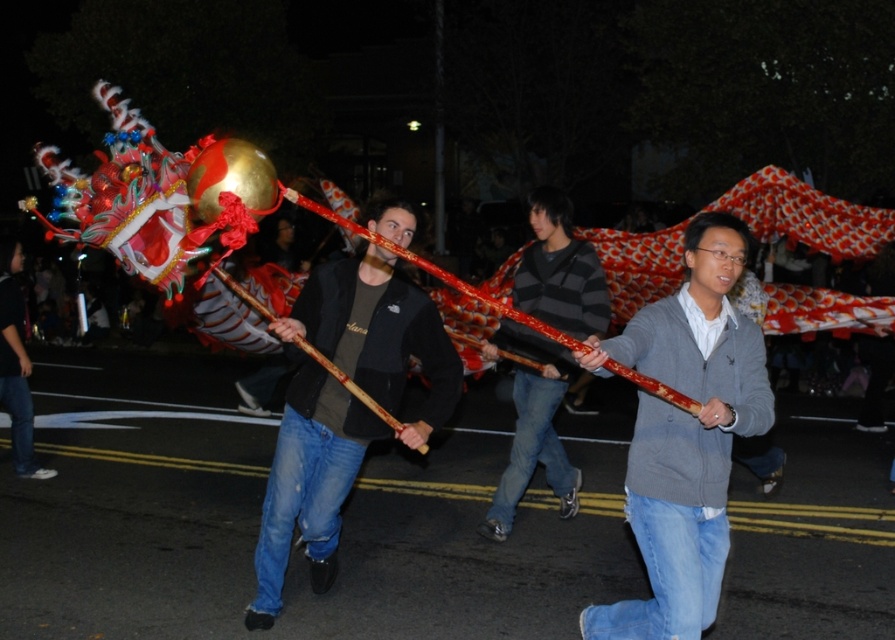
Measure the distance between gray sweater at center and camera.

gray sweater at center is 3.21 meters from camera.

Who is shorter, gray sweater at center or striped sweater at center?

With less height is gray sweater at center.

Is point (720, 314) positioned before point (570, 468)?

Yes, point (720, 314) is in front of point (570, 468).

Image resolution: width=895 pixels, height=640 pixels. In order to click on gray sweater at center in this screenshot , I will do `click(685, 435)`.

Between gray sweater at center and matte black jacket at center, which one has less height?

With less height is gray sweater at center.

Does gray sweater at center appear under matte black jacket at center?

Indeed, gray sweater at center is positioned under matte black jacket at center.

Identify the location of gray sweater at center. The width and height of the screenshot is (895, 640). (685, 435).

Locate an element on the screen. gray sweater at center is located at coordinates (685, 435).

Consider the image. Which is above, matte black jacket at center or striped sweater at center?

striped sweater at center is higher up.

Is point (427, 401) behind point (506, 480)?

No, it is not.

What do you see at coordinates (377, 333) in the screenshot?
I see `matte black jacket at center` at bounding box center [377, 333].

Where is `matte black jacket at center`? Image resolution: width=895 pixels, height=640 pixels. matte black jacket at center is located at coordinates (377, 333).